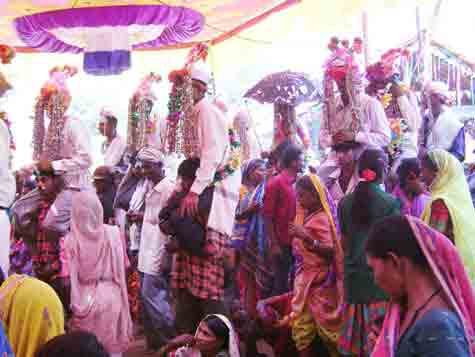
This screenshot has width=475, height=357. In order to click on floral garland in this screenshot , I will do `click(59, 127)`, `click(141, 118)`, `click(185, 96)`.